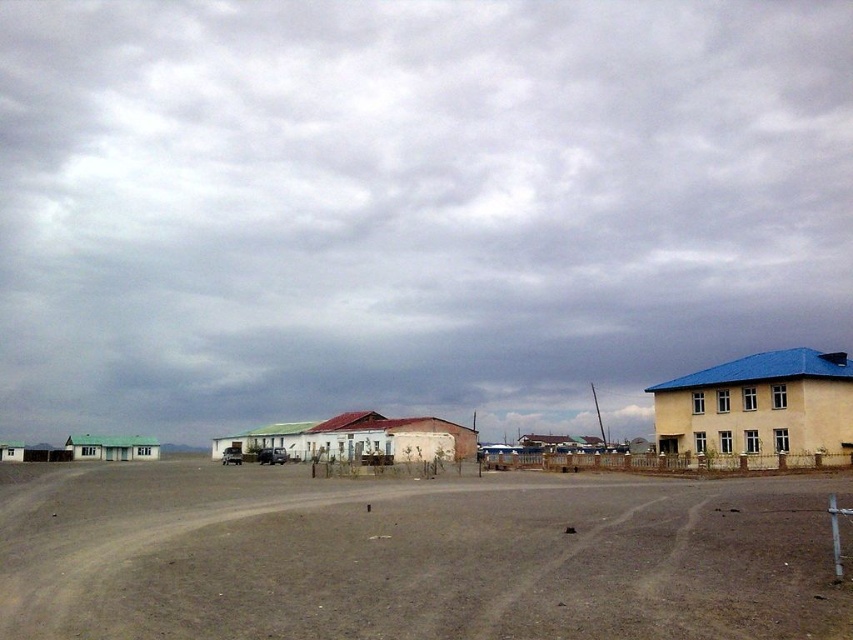
Who is more forward, [340,276] or [721,490]?

Point [721,490] is more forward.

Locate an element on the screen. The width and height of the screenshot is (853, 640). cloudy sky at upper center is located at coordinates (410, 204).